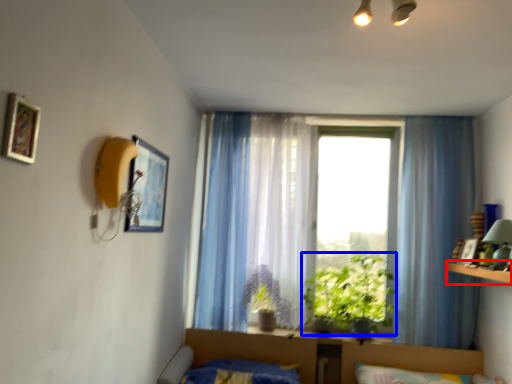
Question: Which point is further to the camera, ledge (highlighted by a red box) or vegetation (highlighted by a blue box)?

Choices:
 (A) ledge
 (B) vegetation

Answer: (B)